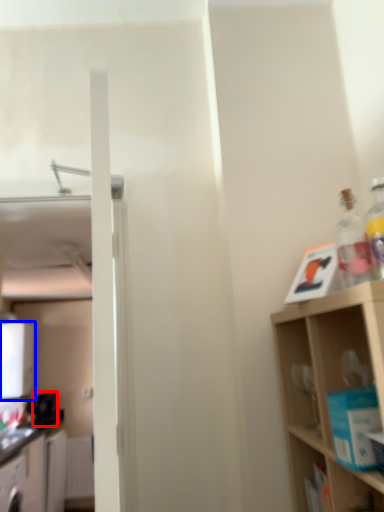
Question: Which point is closer to the camera, appliance (highlighted by a red box) or appliance (highlighted by a blue box)?

Choices:
 (A) appliance
 (B) appliance

Answer: (B)